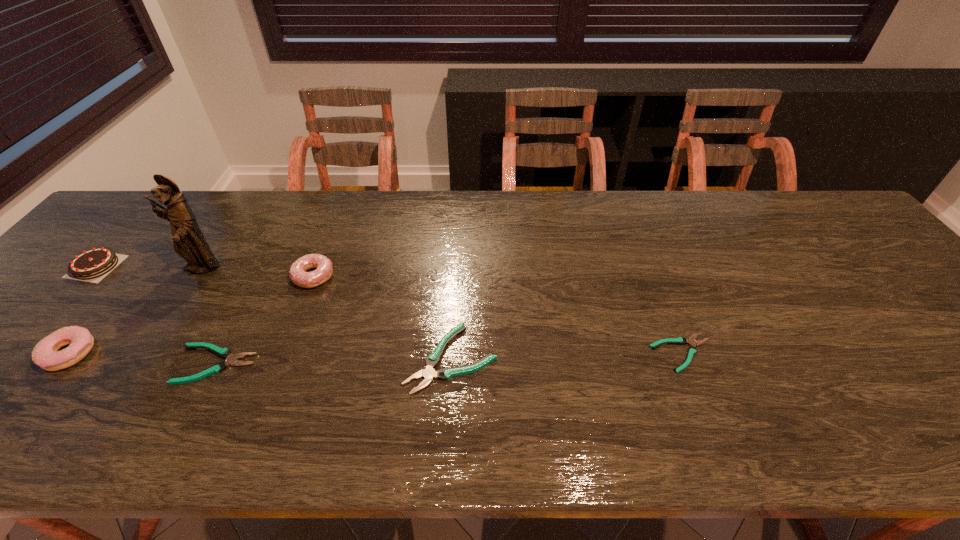
What are the coordinates of `the second tallest pliers` in the screenshot? It's located at (225, 353).

At what (x,y) coordinates should I click in order to perform the action: click on the second shortest object. Please return your answer as a coordinate pair (x, y). Looking at the image, I should click on (225, 353).

Where is `the second object from right to left`? This screenshot has width=960, height=540. the second object from right to left is located at coordinates (429, 373).

In order to click on the fifth tallest object in this screenshot , I will do `click(429, 373)`.

You are a GUI agent. You are given a task and a screenshot of the screen. Output one action in this format:
    pyautogui.click(x=<x>, y=<y>)
    Task: Click on the rightmost pliers
    
    Given the screenshot: What is the action you would take?
    pyautogui.click(x=692, y=350)

Locate an element on the screen. Image resolution: width=960 pixels, height=540 pixels. the shortest pliers is located at coordinates (692, 350).

The image size is (960, 540). Find the location of `the tallest object`. the tallest object is located at coordinates (189, 242).

Locate an element on the screen. the third object from left to right is located at coordinates (189, 242).

At what (x,y) coordinates should I click in order to perform the action: click on chocolate cake. Please return your answer as a coordinate pair (x, y). Looking at the image, I should click on coord(96,262).

Identify the location of the fifth object from left to right. (298, 275).